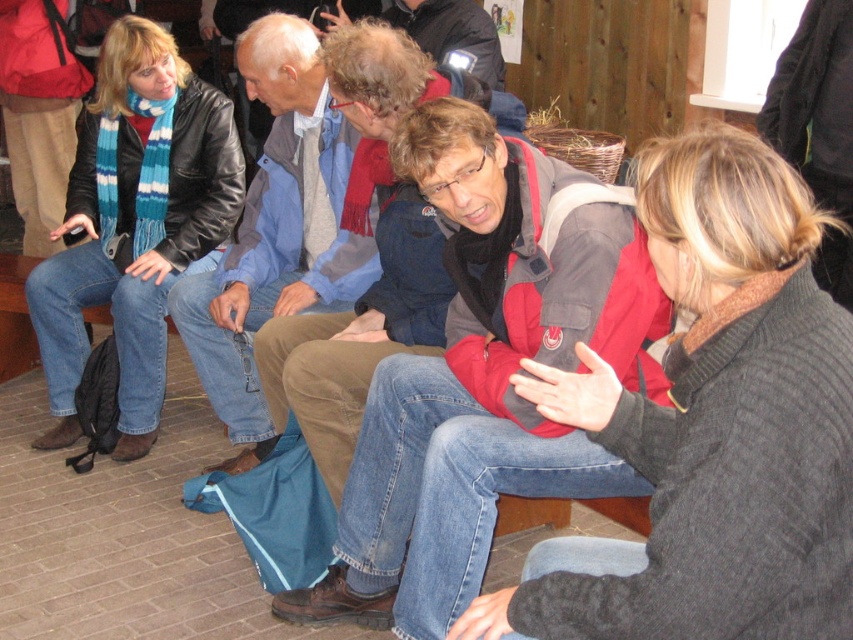
You are standing at the origin of the coordinate system in the image. There is a point at coordinates point (132, 225). What object is located at that point?

The point at coordinates point (132, 225) is located on the matte black leather jacket at left.

You are standing in the waiting area and need to locate the knitted dark gray sweater at center. According to the coordinates provided, where exactly is it positioned in the image?

The knitted dark gray sweater at center is located at the 2D coordinates point (717, 420) in the image.